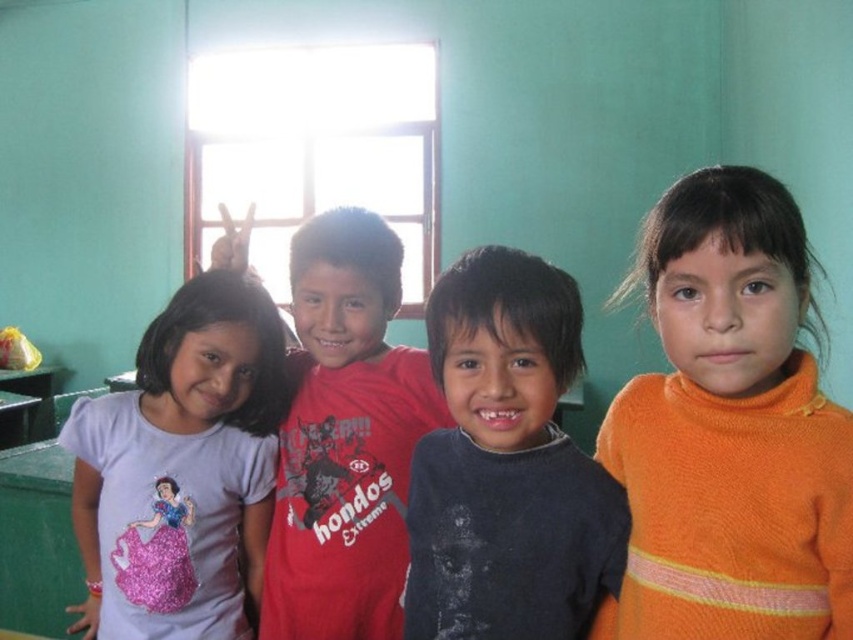
You are standing at the origin of the coordinate system in the image. The orange knitted sweater at right is located at point (729, 429). In which direction should you move to reach the orange knitted sweater at right?

The orange knitted sweater at right is located at coordinates 0.673 on the x axis and 0.856 on the y axis. Since the x value is greater than 0.5, it is to the right of the center. The y value of 0.856 is closer to the top of the image. Therefore, you should move to the right and upwards to reach the orange knitted sweater at right.

From the picture: You are taking a photo of two points in the image. The first point is at coordinate point [664,605] and the second is at point [527,417]. Which point will appear closer to the camera in the photo?

Point [664,605] is further to the camera than point [527,417], so the first point will appear closer to the camera in the photo.

You are a photographer setting up for a group photo. You have two subjects wearing the dark gray sweater at center and the purple cotton shirt at left. Which clothing item is shorter in length?

The dark gray sweater at center is shorter than the purple cotton shirt at left.